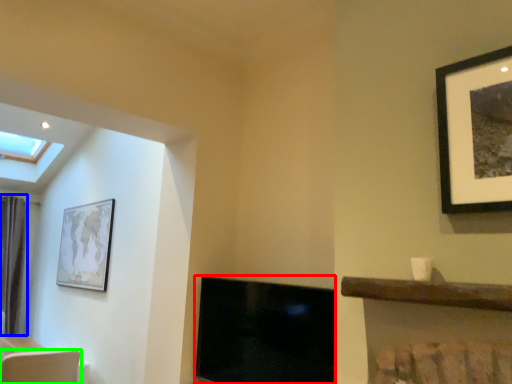
Question: Which object is the closest to the fireplace (highlighted by a red box)? Choose among these: curtain (highlighted by a blue box) or swivel chair (highlighted by a green box).

Choices:
 (A) curtain
 (B) swivel chair

Answer: (B)